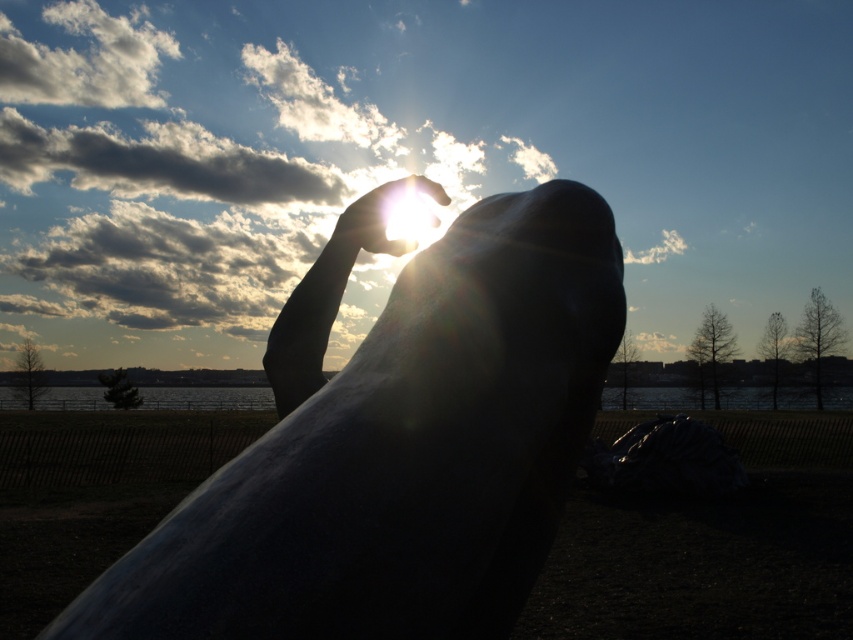
You are a maintenance worker needing to clean both the satin silver statue at center and the translucent glass hand at upper center. You have a ladder that is 3 feet long. Can you reach both objects with the ladder without moving it?

The satin silver statue at center and the translucent glass hand at upper center are 3.52 feet apart. Since the ladder is only 3 feet long, you cannot reach both objects without moving the ladder because the distance between them exceeds the ladder length.

You are a photographer trying to capture the sunset through the heart shape formed by the translucent glass hand at upper center. The satin silver statue at center is blocking your view. Can you move to the left or right to avoid the statue and still frame the heart shape in your shot?

The satin silver statue at center is to the right of the translucent glass hand at upper center. To avoid the statue while keeping the heart shape in view, move to the left side of the statue. This position allows the translucent glass hand at upper center to remain centered in your shot while moving out of the statue obstruction.

You are a photographer standing at the center of the park. You want to take a photo of the satin silver statue at center. According to the coordinates, where should you position yourself relative to the statue to capture it in the best possible way?

The satin silver statue at center is positioned at coordinates point (x=396, y=448). To capture it best, you should position yourself directly in front of it, aligning your camera with the statue to ensure it is centered in your frame.